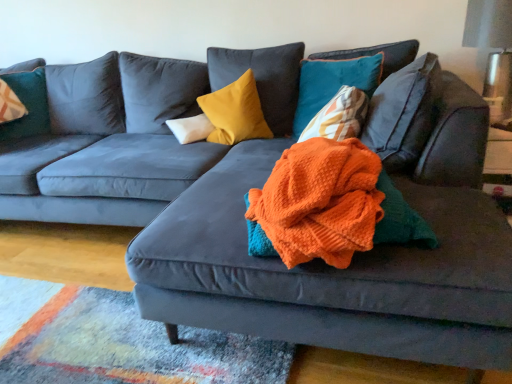
Find the location of a particular element. velvet yellow pillow at center, the 3th pillow in the left-to-right sequence is located at coordinates (234, 112).

Identify the location of velvet yellow pillow at center, the 3th pillow in the left-to-right sequence. Image resolution: width=512 pixels, height=384 pixels. (234, 112).

In the scene shown: Which of these two, velvet yellow pillow at center, the 3th pillow in the left-to-right sequence, or white soft pillow at center, which is counted as the 3th pillow, starting from the right, is bigger?

Bigger between the two is velvet yellow pillow at center, the 3th pillow in the left-to-right sequence.

Based on the photo, considering the relative sizes of velvet yellow pillow at center, which appears as the second pillow when viewed from the right, and white soft pillow at center, which is counted as the second pillow, starting from the left, in the image provided, is velvet yellow pillow at center, which appears as the second pillow when viewed from the right, shorter than white soft pillow at center, which is counted as the second pillow, starting from the left,?

In fact, velvet yellow pillow at center, which appears as the second pillow when viewed from the right, may be taller than white soft pillow at center, which is counted as the second pillow, starting from the left.

Which object is further away from the camera, velvet yellow pillow at center, which appears as the second pillow when viewed from the right, or white soft pillow at center, which is counted as the 3th pillow, starting from the right?

white soft pillow at center, which is counted as the 3th pillow, starting from the right, is further away from the camera.

Do you think white soft pillow at center, which is counted as the 3th pillow, starting from the right, is within orange knitted blanket at center, or outside of it?

white soft pillow at center, which is counted as the 3th pillow, starting from the right, lies outside orange knitted blanket at center.

Considering the sizes of white soft pillow at center, which is counted as the second pillow, starting from the left, and orange knitted blanket at center in the image, is white soft pillow at center, which is counted as the second pillow, starting from the left, wider or thinner than orange knitted blanket at center?

Considering their sizes, white soft pillow at center, which is counted as the second pillow, starting from the left, looks slimmer than orange knitted blanket at center.

Is white soft pillow at center, which is counted as the 3th pillow, starting from the right, with orange knitted blanket at center?

white soft pillow at center, which is counted as the 3th pillow, starting from the right, is not next to orange knitted blanket at center, and they're not touching.

Is point (374, 68) positioned before point (248, 135)?

Yes, point (374, 68) is in front of point (248, 135).

Who is shorter, teal velvet pillow at upper right, positioned as the 4th pillow in left-to-right order, or velvet yellow pillow at center, which appears as the second pillow when viewed from the right?

velvet yellow pillow at center, which appears as the second pillow when viewed from the right.

Between teal velvet pillow at upper right, the first pillow when ordered from right to left, and velvet yellow pillow at center, the 3th pillow in the left-to-right sequence, which one is positioned behind?

velvet yellow pillow at center, the 3th pillow in the left-to-right sequence, is behind.

Can you confirm if teal velvet pillow at upper right, the first pillow when ordered from right to left, is wider than velvet yellow pillow at center, the 3th pillow in the left-to-right sequence?

Incorrect, the width of teal velvet pillow at upper right, the first pillow when ordered from right to left, does not surpass that of velvet yellow pillow at center, the 3th pillow in the left-to-right sequence.

From the image's perspective, is orange knitted blanket at center on velvet teal pillow at upper left, placed as the 1th pillow when sorted from left to right?

No, from the image's perspective, orange knitted blanket at center is not on top of velvet teal pillow at upper left, placed as the 1th pillow when sorted from left to right.

Which object is positioned more to the right, orange knitted blanket at center or velvet teal pillow at upper left, placed as the 1th pillow when sorted from left to right?

From the viewer's perspective, orange knitted blanket at center appears more on the right side.

From the image's perspective, count 4th pillows upward from the orange knitted blanket at center and point to it. Please provide its 2D coordinates.

[(27, 101)]

How many degrees apart are the facing directions of orange knitted blanket at center and velvet teal pillow at upper left, which is the fourth pillow in right-to-left order?

159 degrees separate the facing orientations of orange knitted blanket at center and velvet teal pillow at upper left, which is the fourth pillow in right-to-left order.

From a real-world perspective, relative to teal velvet pillow at upper right, positioned as the 4th pillow in left-to-right order, is white soft pillow at center, which is counted as the 3th pillow, starting from the right, vertically above or below?

In terms of real-world spatial position, white soft pillow at center, which is counted as the 3th pillow, starting from the right, is below teal velvet pillow at upper right, positioned as the 4th pillow in left-to-right order.

Considering the relative positions of white soft pillow at center, which is counted as the second pillow, starting from the left, and teal velvet pillow at upper right, the first pillow when ordered from right to left, in the image provided, is white soft pillow at center, which is counted as the second pillow, starting from the left, to the right of teal velvet pillow at upper right, the first pillow when ordered from right to left, from the viewer's perspective?

Incorrect, white soft pillow at center, which is counted as the second pillow, starting from the left, is not on the right side of teal velvet pillow at upper right, the first pillow when ordered from right to left.

Considering the positions of points (180, 133) and (307, 107), is point (180, 133) farther from camera compared to point (307, 107)?

Yes, point (180, 133) is behind point (307, 107).

Who is more distant, velvet teal pillow at upper left, which is the fourth pillow in right-to-left order, or velvet yellow pillow at center, the 3th pillow in the left-to-right sequence?

velvet teal pillow at upper left, which is the fourth pillow in right-to-left order.

Which is correct: velvet teal pillow at upper left, placed as the 1th pillow when sorted from left to right, is inside velvet yellow pillow at center, which appears as the second pillow when viewed from the right, or outside of it?

velvet teal pillow at upper left, placed as the 1th pillow when sorted from left to right, is located beyond the bounds of velvet yellow pillow at center, which appears as the second pillow when viewed from the right.

Is velvet teal pillow at upper left, placed as the 1th pillow when sorted from left to right, wider or thinner than velvet yellow pillow at center, the 3th pillow in the left-to-right sequence?

In the image, velvet teal pillow at upper left, placed as the 1th pillow when sorted from left to right, appears to be wider than velvet yellow pillow at center, the 3th pillow in the left-to-right sequence.

Considering the sizes of velvet teal pillow at upper left, placed as the 1th pillow when sorted from left to right, and velvet yellow pillow at center, which appears as the second pillow when viewed from the right, in the image, is velvet teal pillow at upper left, placed as the 1th pillow when sorted from left to right, bigger or smaller than velvet yellow pillow at center, which appears as the second pillow when viewed from the right,?

Considering their sizes, velvet teal pillow at upper left, placed as the 1th pillow when sorted from left to right, takes up less space than velvet yellow pillow at center, which appears as the second pillow when viewed from the right.

Could you tell me if teal velvet pillow at upper right, positioned as the 4th pillow in left-to-right order, is turned towards velvet teal pillow at upper left, which is the fourth pillow in right-to-left order?

No, teal velvet pillow at upper right, positioned as the 4th pillow in left-to-right order, is not turned towards velvet teal pillow at upper left, which is the fourth pillow in right-to-left order.

From the picture: Is teal velvet pillow at upper right, the first pillow when ordered from right to left, to the right of velvet teal pillow at upper left, which is the fourth pillow in right-to-left order, from the viewer's perspective?

Indeed, teal velvet pillow at upper right, the first pillow when ordered from right to left, is positioned on the right side of velvet teal pillow at upper left, which is the fourth pillow in right-to-left order.

Is point (298, 129) positioned before point (30, 75)?

Yes, point (298, 129) is closer to viewer.

From a real-world perspective, is teal velvet pillow at upper right, the first pillow when ordered from right to left, positioned over velvet teal pillow at upper left, placed as the 1th pillow when sorted from left to right, based on gravity?

No.

Where is `the 1st pillow positioned above the white soft pillow at center, which is counted as the 3th pillow, starting from the right (from the image's perspective)`? the 1st pillow positioned above the white soft pillow at center, which is counted as the 3th pillow, starting from the right (from the image's perspective) is located at coordinates (234, 112).

You are a GUI agent. You are given a task and a screenshot of the screen. Output one action in this format:
    pyautogui.click(x=<x>, y=<y>)
    Task: Click on the 1st pillow above the orange knitted blanket at center (from a real-world perspective)
    This screenshot has width=512, height=384.
    Given the screenshot: What is the action you would take?
    pyautogui.click(x=190, y=128)

Based on their spatial positions, is velvet yellow pillow at center, the 3th pillow in the left-to-right sequence, or orange knitted blanket at center closer to teal velvet pillow at upper right, the first pillow when ordered from right to left?

The object closer to teal velvet pillow at upper right, the first pillow when ordered from right to left, is velvet yellow pillow at center, the 3th pillow in the left-to-right sequence.

From the image, which object appears to be nearer to orange knitted blanket at center, velvet yellow pillow at center, which appears as the second pillow when viewed from the right, or velvet teal pillow at upper left, which is the fourth pillow in right-to-left order?

Based on the image, velvet yellow pillow at center, which appears as the second pillow when viewed from the right, appears to be nearer to orange knitted blanket at center.

From the picture: When comparing their distances from velvet teal pillow at upper left, which is the fourth pillow in right-to-left order, does white soft pillow at center, which is counted as the 3th pillow, starting from the right, or velvet yellow pillow at center, the 3th pillow in the left-to-right sequence, seem closer?

Among the two, white soft pillow at center, which is counted as the 3th pillow, starting from the right, is located nearer to velvet teal pillow at upper left, which is the fourth pillow in right-to-left order.

Which object lies further to the anchor point white soft pillow at center, which is counted as the 3th pillow, starting from the right, orange knitted blanket at center or velvet yellow pillow at center, which appears as the second pillow when viewed from the right?

orange knitted blanket at center.

Based on their spatial positions, is velvet teal pillow at upper left, placed as the 1th pillow when sorted from left to right, or orange knitted blanket at center further from white soft pillow at center, which is counted as the second pillow, starting from the left?

Based on the image, orange knitted blanket at center appears to be further to white soft pillow at center, which is counted as the second pillow, starting from the left.

Which object lies further to the anchor point velvet teal pillow at upper left, which is the fourth pillow in right-to-left order, white soft pillow at center, which is counted as the 3th pillow, starting from the right, or orange knitted blanket at center?

The object further to velvet teal pillow at upper left, which is the fourth pillow in right-to-left order, is orange knitted blanket at center.

Which object lies nearer to the anchor point orange knitted blanket at center, velvet teal pillow at upper left, which is the fourth pillow in right-to-left order, or white soft pillow at center, which is counted as the second pillow, starting from the left?

Among the two, white soft pillow at center, which is counted as the second pillow, starting from the left, is located nearer to orange knitted blanket at center.

When comparing their distances from white soft pillow at center, which is counted as the 3th pillow, starting from the right, does velvet teal pillow at upper left, placed as the 1th pillow when sorted from left to right, or velvet yellow pillow at center, the 3th pillow in the left-to-right sequence, seem closer?

Based on the image, velvet yellow pillow at center, the 3th pillow in the left-to-right sequence, appears to be nearer to white soft pillow at center, which is counted as the 3th pillow, starting from the right.

You are a GUI agent. You are given a task and a screenshot of the screen. Output one action in this format:
    pyautogui.click(x=<x>, y=<y>)
    Task: Click on the pillow between orange knitted blanket at center and velvet yellow pillow at center, which appears as the second pillow when viewed from the right, in the front-back direction
    
    Given the screenshot: What is the action you would take?
    pyautogui.click(x=333, y=83)

The width and height of the screenshot is (512, 384). I want to click on pillow located between velvet teal pillow at upper left, which is the fourth pillow in right-to-left order, and velvet yellow pillow at center, the 3th pillow in the left-to-right sequence, in the left-right direction, so click(x=190, y=128).

You are a GUI agent. You are given a task and a screenshot of the screen. Output one action in this format:
    pyautogui.click(x=<x>, y=<y>)
    Task: Click on the blanket located between velvet teal pillow at upper left, placed as the 1th pillow when sorted from left to right, and teal velvet pillow at upper right, the first pillow when ordered from right to left, in the left-right direction
    The width and height of the screenshot is (512, 384).
    Given the screenshot: What is the action you would take?
    pyautogui.click(x=320, y=201)

What are the coordinates of `pillow located between white soft pillow at center, which is counted as the 3th pillow, starting from the right, and teal velvet pillow at upper right, the first pillow when ordered from right to left, in the left-right direction` in the screenshot? It's located at (234, 112).